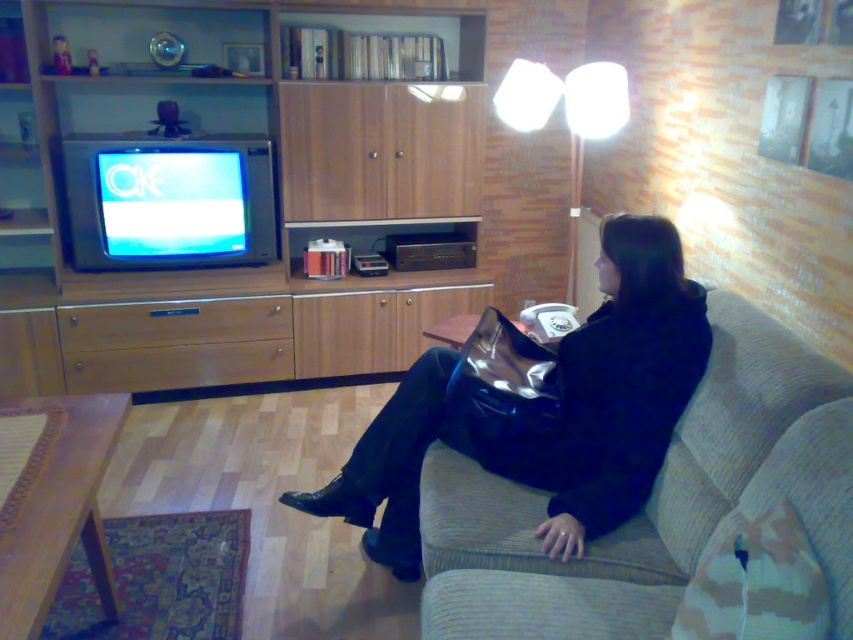
In the scene shown: You are standing in the living room and want to pick up the black leather jacket at center and the white fabric lamp at upper center. Which object will you need to reach down to grab first?

The black leather jacket at center is closer to the viewer than the white fabric lamp at upper center, so you will need to reach down to grab the black leather jacket at center first.

You are a delivery person who just arrived at the house. You need to place a package on the floor near the black leather jacket at center. Where should you put it?

The package should be placed near the black leather jacket at center, which is located at coordinates point (552, 412).